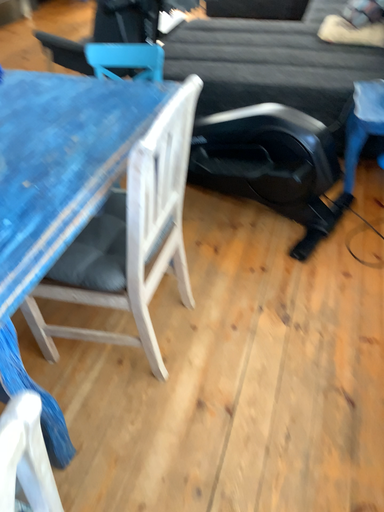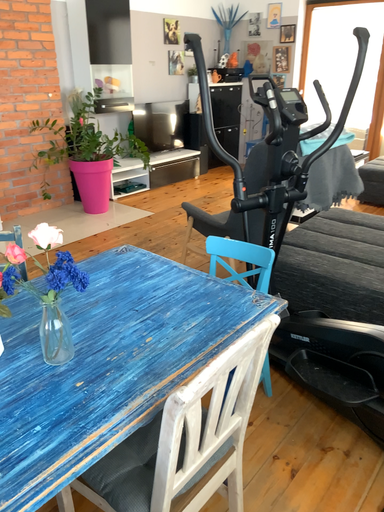
Question: How did the camera likely rotate when shooting the video?

Choices:
 (A) rotated right
 (B) rotated left

Answer: (B)